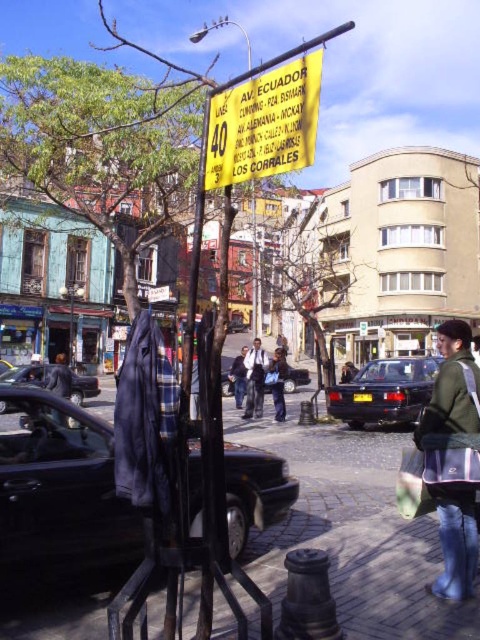
Is green fabric jacket at lower right bigger than green fabric shopping bag at lower right?

Indeed, green fabric jacket at lower right has a larger size compared to green fabric shopping bag at lower right.

Who is lower down, green fabric jacket at lower right or green fabric shopping bag at lower right?

green fabric shopping bag at lower right is below.

Is point (466, 358) closer to camera compared to point (412, 458)?

Yes, point (466, 358) is in front of point (412, 458).

This screenshot has height=640, width=480. I want to click on green fabric jacket at lower right, so click(x=452, y=460).

Does point (15, 492) come in front of point (261, 365)?

Yes, it is in front of point (261, 365).

Which is in front, point (264, 474) or point (254, 365)?

Positioned in front is point (264, 474).

Between point (73, 461) and point (262, 364), which one is positioned in front?

Point (73, 461)

Find the location of a particular element. The width and height of the screenshot is (480, 640). shiny black car at left is located at coordinates tap(59, 488).

Between point (45, 440) and point (340, 406), which one is positioned in front?

Point (45, 440) is in front.

Does shiny black car at left appear on the left side of dark blue metallic sedan at center?

Correct, you'll find shiny black car at left to the left of dark blue metallic sedan at center.

Between point (235, 488) and point (381, 404), which one is positioned behind?

Positioned behind is point (381, 404).

Locate an element on the screen. This screenshot has height=640, width=480. shiny black car at left is located at coordinates (59, 488).